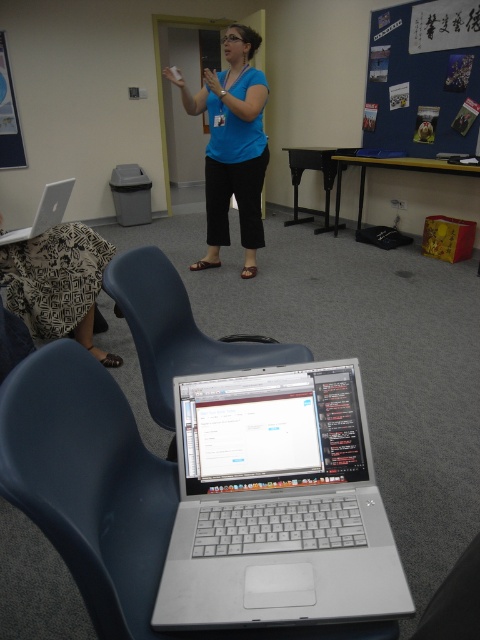
Measure the distance from blue plastic chair at center to matte silver laptop at left.

They are 3.68 feet apart.

Does blue plastic chair at center have a lesser height compared to matte silver laptop at left?

Incorrect, blue plastic chair at center's height does not fall short of matte silver laptop at left's.

Who is more distant from viewer, (152, 266) or (66, 179)?

Point (66, 179)

Locate an element on the screen. blue plastic chair at center is located at coordinates (178, 330).

Does matte blue shirt at center have a greater height compared to matte silver laptop at left?

Yes, matte blue shirt at center is taller than matte silver laptop at left.

Between point (252, 212) and point (52, 186), which one is positioned behind?

The point (252, 212) is more distant.

Which is in front, point (184, 88) or point (48, 218)?

Positioned in front is point (48, 218).

I want to click on matte blue shirt at center, so click(231, 145).

Where is `blue fabric bulletin board at upper right`? blue fabric bulletin board at upper right is located at coordinates pyautogui.click(x=423, y=77).

Is blue fabric bulletin board at upper right positioned behind matte blue shirt at center?

Yes, it is.

Who is more forward, (383, 136) or (236, 108)?

Point (236, 108) is in front.

This screenshot has height=640, width=480. Find the location of `blue fabric bulletin board at upper right`. blue fabric bulletin board at upper right is located at coordinates (423, 77).